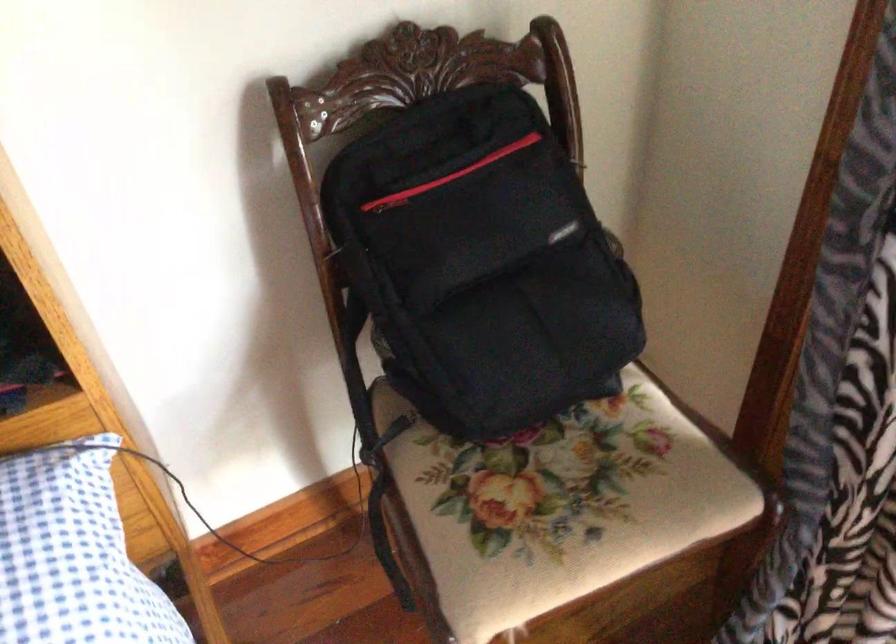
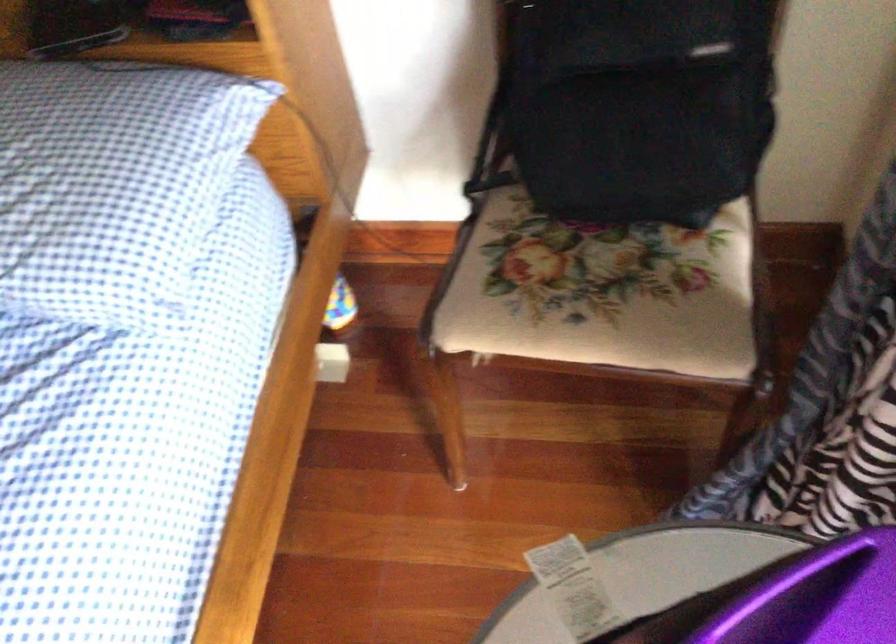
Locate, in the second image, the point that corresponds to the point at 592,496 in the first image.

(599, 292)